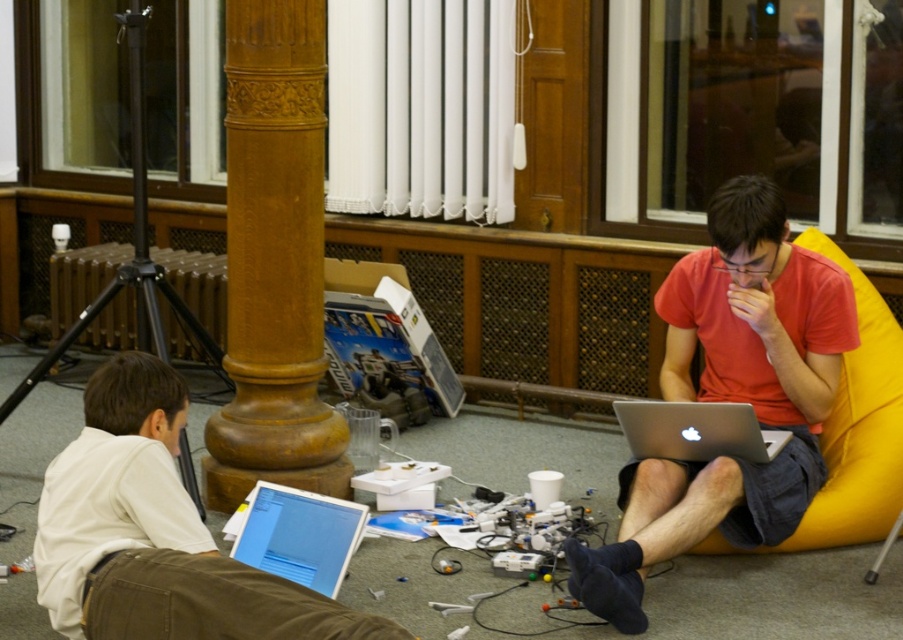
Is wooden column at center below white matte laptop at lower left?

Actually, wooden column at center is above white matte laptop at lower left.

Can you confirm if wooden column at center is positioned above white matte laptop at lower left?

Correct, wooden column at center is located above white matte laptop at lower left.

Describe the element at coordinates (275, 259) in the screenshot. I see `wooden column at center` at that location.

Identify the location of wooden column at center. This screenshot has height=640, width=903. (275, 259).

Can you confirm if yellow fabric bean bag chair at right is bigger than silver metallic laptop at center?

Correct, yellow fabric bean bag chair at right is larger in size than silver metallic laptop at center.

Who is more distant from viewer, (833, 436) or (760, 460)?

The point (833, 436) is behind.

Image resolution: width=903 pixels, height=640 pixels. What do you see at coordinates (858, 426) in the screenshot?
I see `yellow fabric bean bag chair at right` at bounding box center [858, 426].

Where is `yellow fabric bean bag chair at right`? Image resolution: width=903 pixels, height=640 pixels. yellow fabric bean bag chair at right is located at coordinates (858, 426).

From the picture: Can you confirm if wooden column at center is smaller than white glossy laptop at lower left?

No, wooden column at center is not smaller than white glossy laptop at lower left.

Can you confirm if wooden column at center is thinner than white glossy laptop at lower left?

In fact, wooden column at center might be wider than white glossy laptop at lower left.

At what (x,y) coordinates should I click in order to perform the action: click on wooden column at center. Please return your answer as a coordinate pair (x, y). The width and height of the screenshot is (903, 640). Looking at the image, I should click on (275, 259).